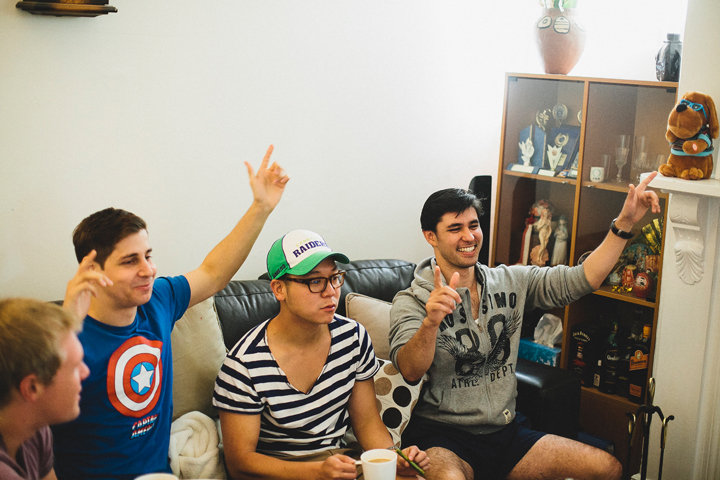
The width and height of the screenshot is (720, 480). I want to click on flower vase, so click(561, 47), click(666, 65).